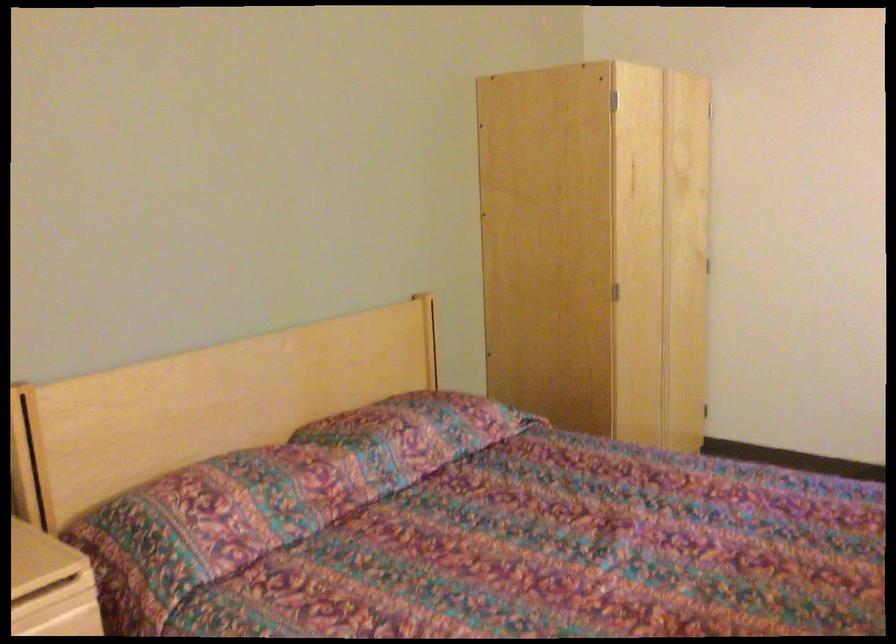
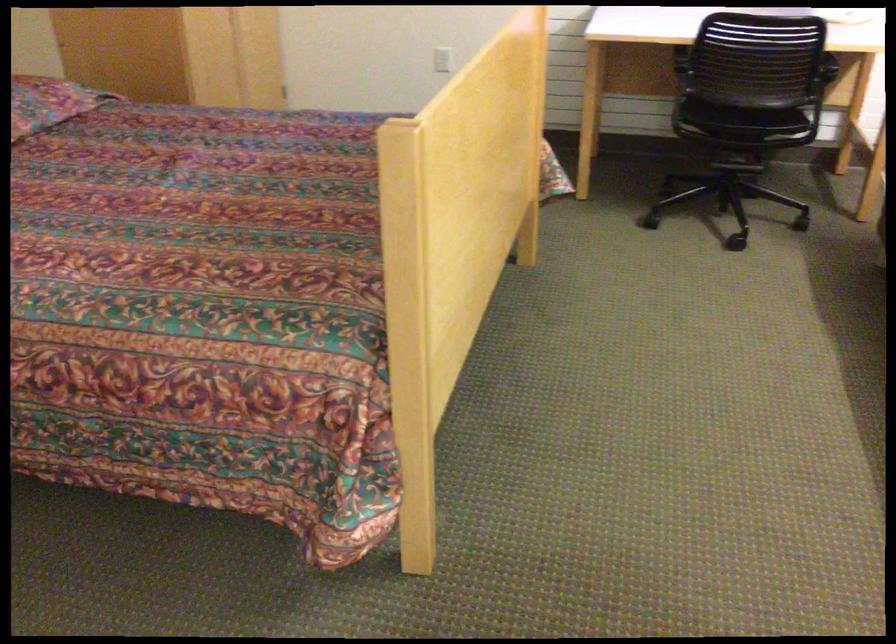
The images are taken continuously from a first-person perspective. In which direction is your viewpoint rotating?

The camera rotated toward right-down.